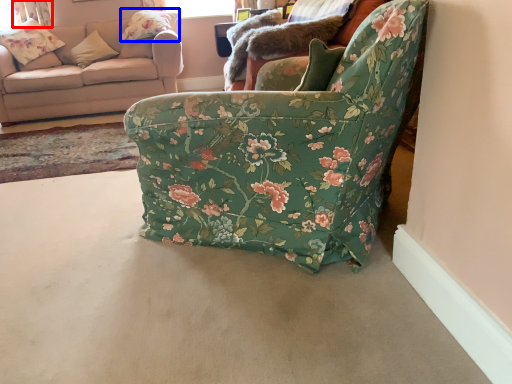
Question: Among these objects, which one is farthest to the camera, curtain (highlighted by a red box) or pillow (highlighted by a blue box)?

Choices:
 (A) curtain
 (B) pillow

Answer: (A)